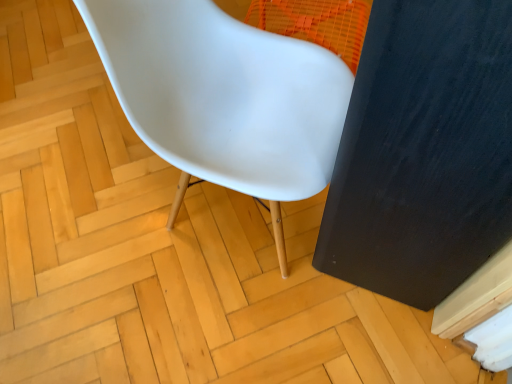
Question: From a real-world perspective, is black matte screen door at right physically located above or below white plastic chair at center?

Choices:
 (A) below
 (B) above

Answer: (B)

Question: Considering the positions of point (x=487, y=140) and point (x=123, y=8), is point (x=487, y=140) closer or farther from the camera than point (x=123, y=8)?

Choices:
 (A) farther
 (B) closer

Answer: (B)

Question: In the image, is black matte screen door at right on the left side or the right side of white plastic chair at center?

Choices:
 (A) left
 (B) right

Answer: (B)

Question: From a real-world perspective, is white plastic chair at center physically located above or below black matte screen door at right?

Choices:
 (A) above
 (B) below

Answer: (B)

Question: Is point pos(228,155) closer or farther from the camera than point pos(482,107)?

Choices:
 (A) farther
 (B) closer

Answer: (A)

Question: Relative to black matte screen door at right, is white plastic chair at center in front or behind?

Choices:
 (A) behind
 (B) front

Answer: (A)

Question: In terms of height, does white plastic chair at center look taller or shorter compared to black matte screen door at right?

Choices:
 (A) tall
 (B) short

Answer: (B)